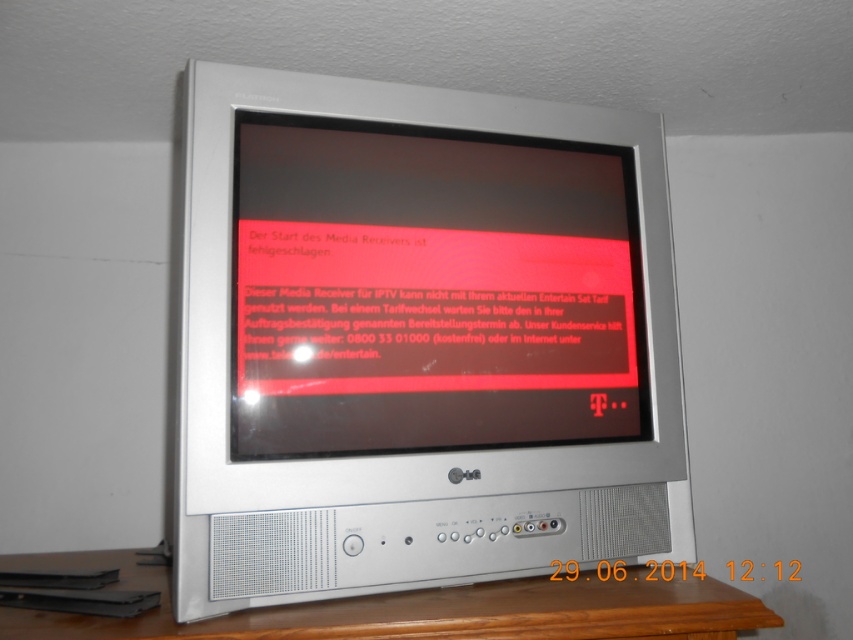
Question: Is matte black screen at center below wooden table at lower center?

Choices:
 (A) yes
 (B) no

Answer: (B)

Question: Which point appears farthest from the camera in this image?

Choices:
 (A) (693, 577)
 (B) (646, 388)

Answer: (B)

Question: In this image, where is silver metallic monitor at center located relative to wooden table at lower center?

Choices:
 (A) above
 (B) below

Answer: (A)

Question: Which object is the closest to the silver metallic monitor at center?

Choices:
 (A) matte black screen at center
 (B) wooden table at lower center

Answer: (A)

Question: Can you confirm if silver metallic monitor at center is positioned below matte black screen at center?

Choices:
 (A) no
 (B) yes

Answer: (B)

Question: Which point is farther to the camera?

Choices:
 (A) wooden table at lower center
 (B) silver metallic monitor at center

Answer: (B)